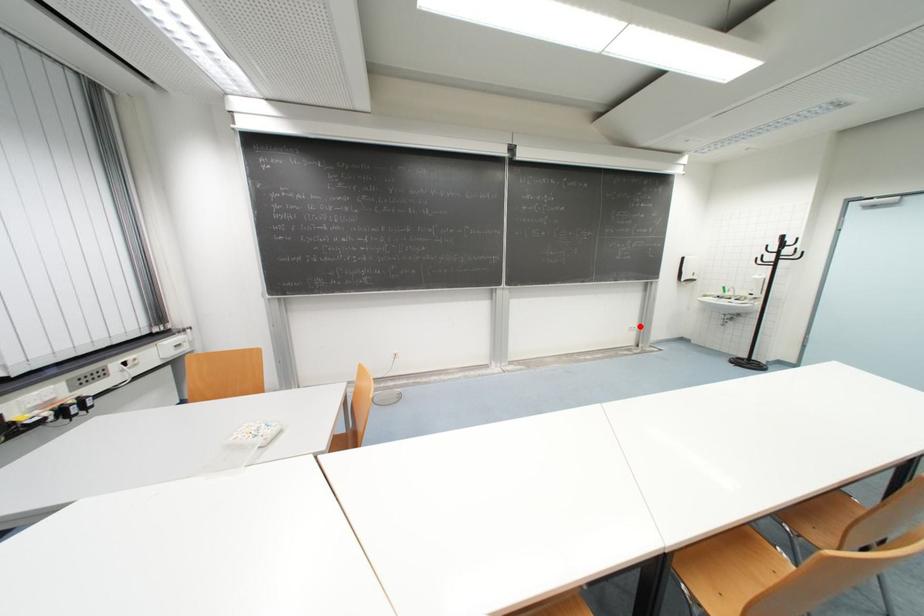
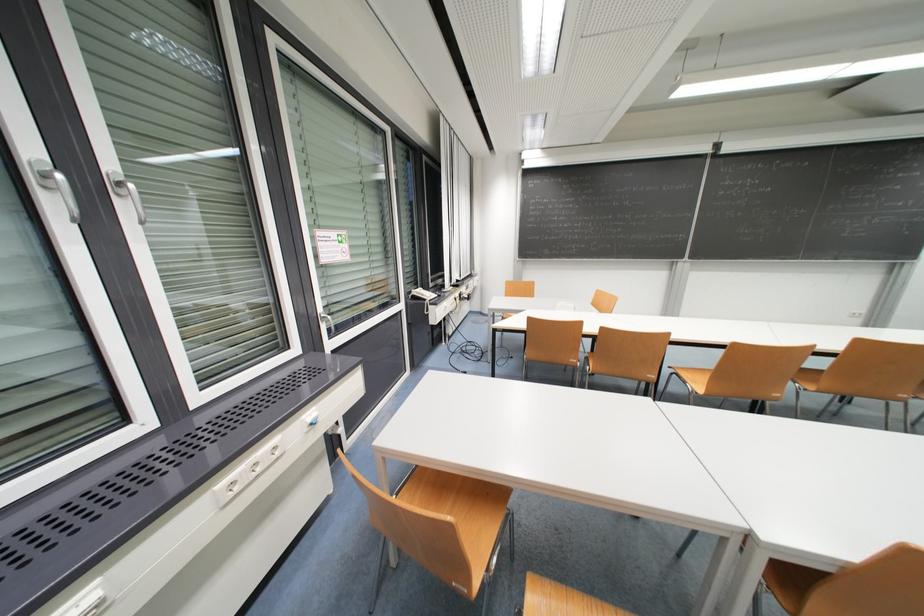
Question: I am providing you with two images of the same scene from different viewpoints. In image1, a red point is highlighted. Considering the same 3D point in image2, which of the following is correct?

Choices:
 (A) It is closer
 (B) It is farther

Answer: (B)